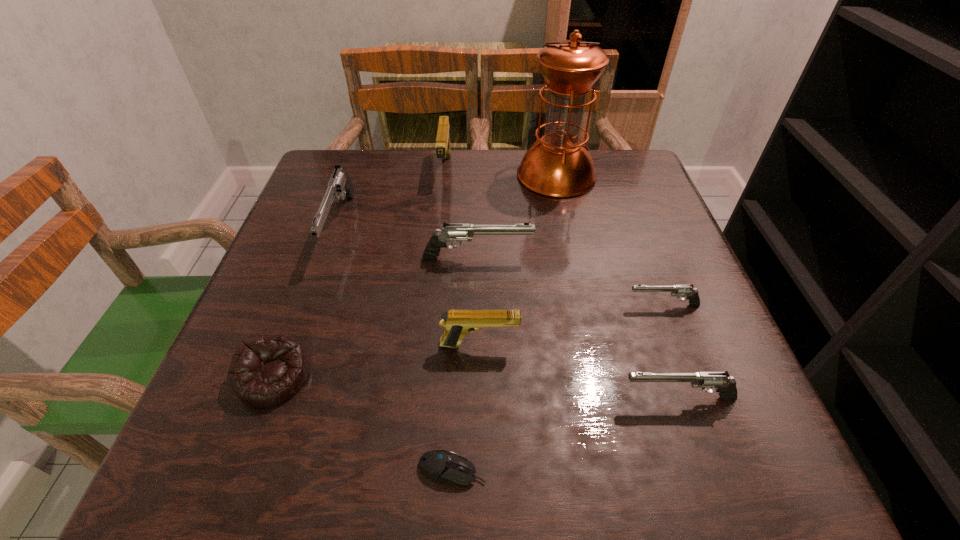
Locate an element on the screen. The height and width of the screenshot is (540, 960). pistol at the left edge is located at coordinates (340, 185).

The width and height of the screenshot is (960, 540). What are the coordinates of `beanbag that is at the left edge` in the screenshot? It's located at (267, 370).

Locate an element on the screen. Image resolution: width=960 pixels, height=540 pixels. oil lamp present at the right edge is located at coordinates (559, 165).

The image size is (960, 540). I want to click on object positioned at the far left corner, so click(x=340, y=185).

Locate an element on the screen. object at the far right corner is located at coordinates (559, 165).

The width and height of the screenshot is (960, 540). In the image, there is a desktop. Find the location of `vacant space at the far edge`. vacant space at the far edge is located at coordinates (407, 191).

This screenshot has height=540, width=960. Identify the location of free region at the left edge. (306, 236).

I want to click on free space at the right edge of the desktop, so pos(618,271).

Where is `vacant space at the near left corner`? The image size is (960, 540). vacant space at the near left corner is located at coordinates (264, 456).

This screenshot has width=960, height=540. In the image, there is a desktop. In order to click on blank space at the near right corner in this screenshot , I will do `click(778, 484)`.